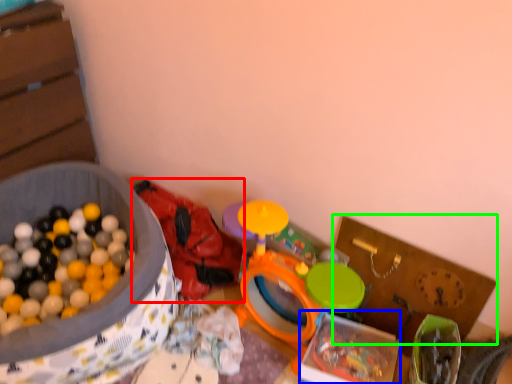
Question: Based on their relative distances, which object is farther from toy (highlighted by a red box)? Choose from box (highlighted by a blue box) and cardboard box (highlighted by a green box).

Choices:
 (A) box
 (B) cardboard box

Answer: (B)